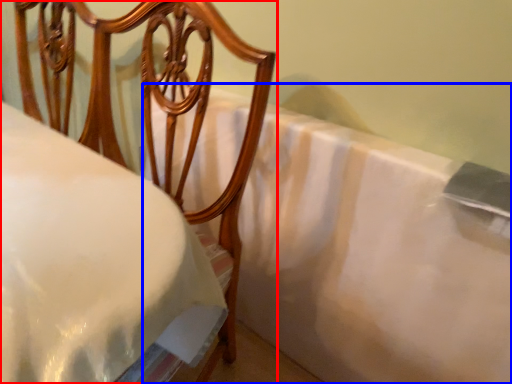
Question: Which of the following is the closest to the observer, furniture (highlighted by a red box) or sheet (highlighted by a blue box)?

Choices:
 (A) furniture
 (B) sheet

Answer: (A)